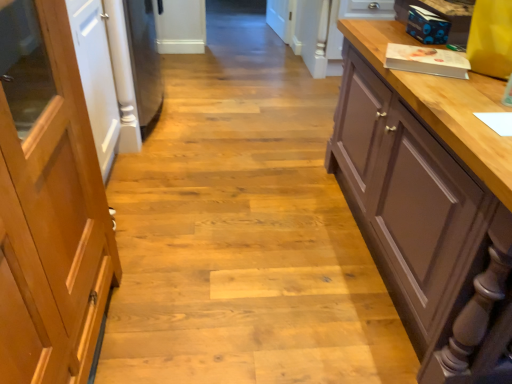
Where is `vacant space to the right of light brown wood door at left`? The height and width of the screenshot is (384, 512). vacant space to the right of light brown wood door at left is located at coordinates [201, 320].